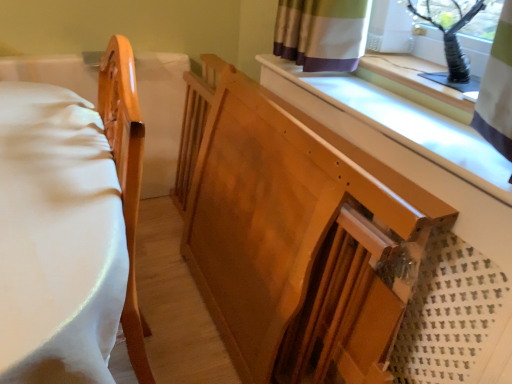
I want to click on vacant space situated above wooden changing table at center (from a real-world perspective), so click(x=402, y=118).